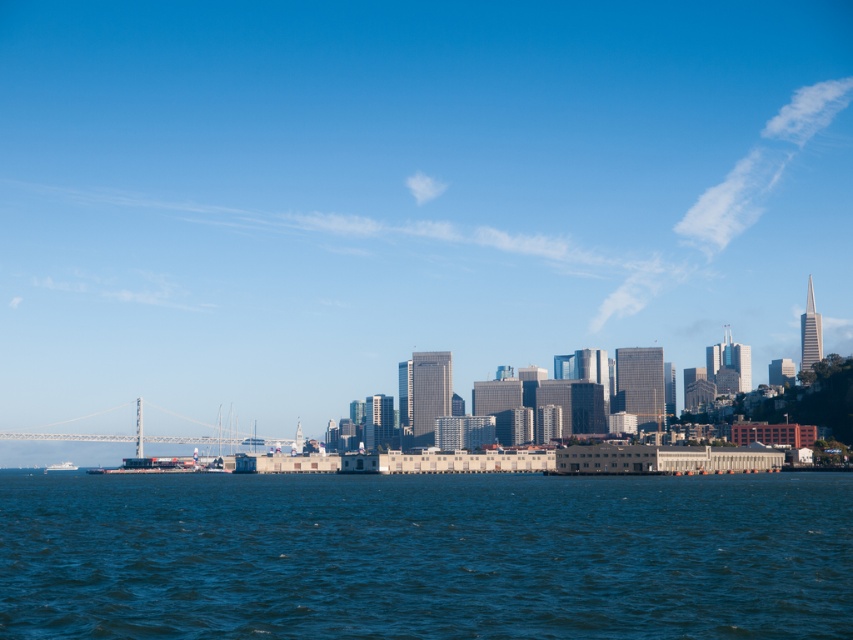
This screenshot has width=853, height=640. I want to click on blue water at center, so point(424,556).

Between point (61, 612) and point (138, 403), which one is positioned behind?

Positioned behind is point (138, 403).

In order to click on blue water at center in this screenshot , I will do `click(424, 556)`.

Is point (99, 358) positioned before point (65, 420)?

Yes, point (99, 358) is in front of point (65, 420).

How distant is transparent glass skyscrapers at center from metallic gray bridge at left?

383.57 feet

What do you see at coordinates (403, 196) in the screenshot? The width and height of the screenshot is (853, 640). I see `transparent glass skyscrapers at center` at bounding box center [403, 196].

Identify the location of transparent glass skyscrapers at center. This screenshot has width=853, height=640. (403, 196).

Is metallic gray bridge at left shorter than white glossy boat at lower left?

In fact, metallic gray bridge at left may be taller than white glossy boat at lower left.

Is point (56, 438) positioned after point (54, 468)?

No, (56, 438) is in front of (54, 468).

Where is `metallic gray bridge at left`? metallic gray bridge at left is located at coordinates (111, 435).